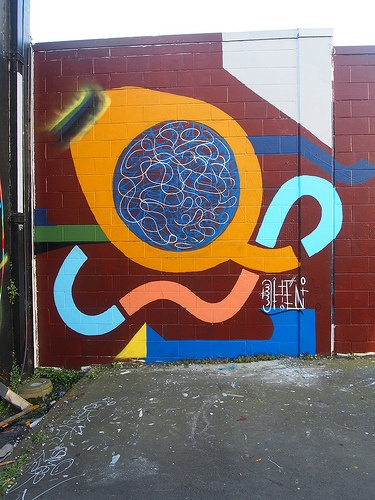
At what (x,y) coordinates should I click in order to perform the action: click on mural on wall. Please return your answer as a coordinate pair (x, y). Image resolution: width=375 pixels, height=500 pixels. Looking at the image, I should click on click(x=250, y=186).